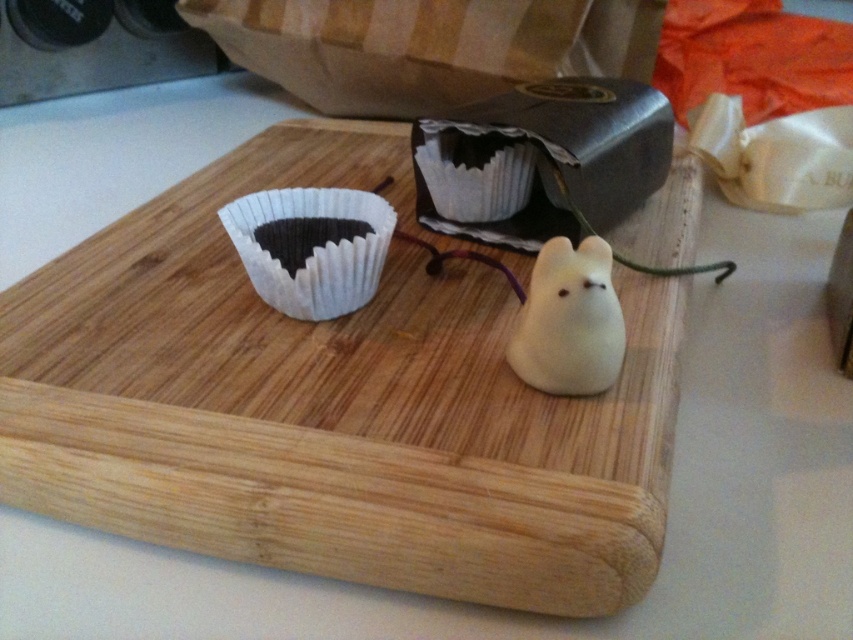
You are a chef who needs to place a 35 cm long rolling pin on the wooden cutting board at center. The matte white paper cupcake at center is already on the board. Can the rolling pin fit on the board without overlapping the cupcake?

The wooden cutting board at center is 34.14 centimeters from the matte white paper cupcake at center. Since the rolling pin is 35 cm long, it would overlap the cupcake as there is insufficient space between them.

You are a chef preparing a dish and need to place a metallic hammer with a brown handle and a silver head onto the wooden cutting board at center. However, the cutting board is already occupied by a cupcake liner and a mouse shaped object. Can you fit the hammer on the cutting board without moving the existing items?

The wooden cutting board at center is located at point (331,404). Since the hammer is resting on the counter behind it, there might be space to place the hammer on the cutting board without moving the existing items, but the exact dimensions are not provided. However, based on the description, the cutting board has two small items, so there might be enough space depending on the hammer size.